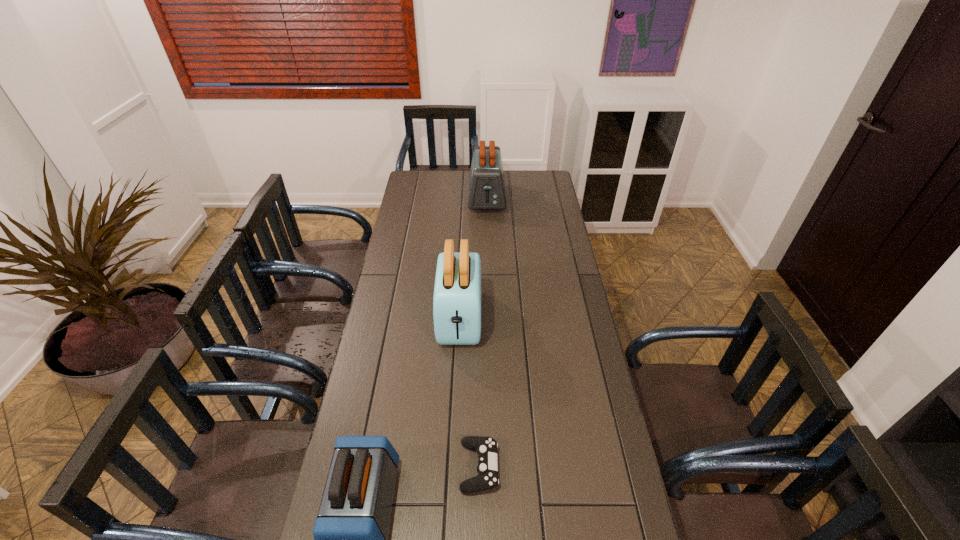
Image resolution: width=960 pixels, height=540 pixels. Find the location of `vacant position in the image that satisfies the following two spatial constraints: 1. on the front-facing side of the farthest object; 2. on the surface of the shortest object`. vacant position in the image that satisfies the following two spatial constraints: 1. on the front-facing side of the farthest object; 2. on the surface of the shortest object is located at coordinates (492, 467).

Where is `free space that satisfies the following two spatial constraints: 1. on the front-facing side of the farthest toaster; 2. on the surface of the control`? The width and height of the screenshot is (960, 540). free space that satisfies the following two spatial constraints: 1. on the front-facing side of the farthest toaster; 2. on the surface of the control is located at coordinates (492, 467).

Image resolution: width=960 pixels, height=540 pixels. What are the coordinates of `free location that satisfies the following two spatial constraints: 1. on the front-facing side of the farthest object; 2. on the surface of the control` in the screenshot? It's located at (492, 467).